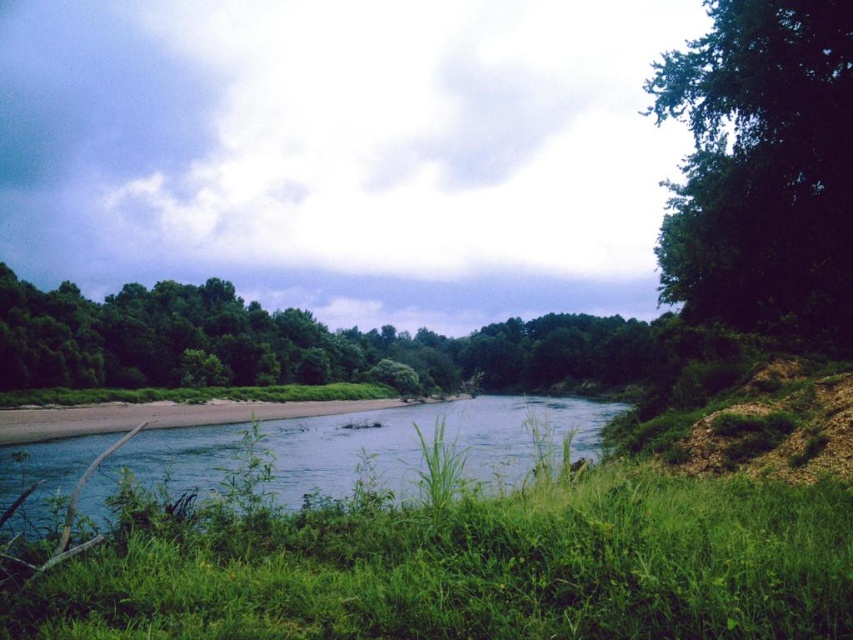
Can you confirm if green leafy trees at center is positioned to the right of clear blue water at center?

Indeed, green leafy trees at center is positioned on the right side of clear blue water at center.

Who is more distant from viewer, (206,349) or (16,456)?

The point (206,349) is behind.

The image size is (853, 640). What are the coordinates of `green leafy trees at center` in the screenshot? It's located at (288, 342).

Does green grass at lower center have a larger size compared to clear blue water at center?

No.

Measure the distance between green grass at lower center and clear blue water at center.

84.57 feet

Where is `green grass at lower center`? Image resolution: width=853 pixels, height=640 pixels. green grass at lower center is located at coordinates (469, 566).

The height and width of the screenshot is (640, 853). Describe the element at coordinates (469, 566) in the screenshot. I see `green grass at lower center` at that location.

Can you confirm if green grass at lower center is thinner than green leafy trees at center?

Yes.

From the picture: Who is more distant from viewer, (670,541) or (106,349)?

The point (106,349) is behind.

Locate an element on the screen. This screenshot has width=853, height=640. green grass at lower center is located at coordinates (469, 566).